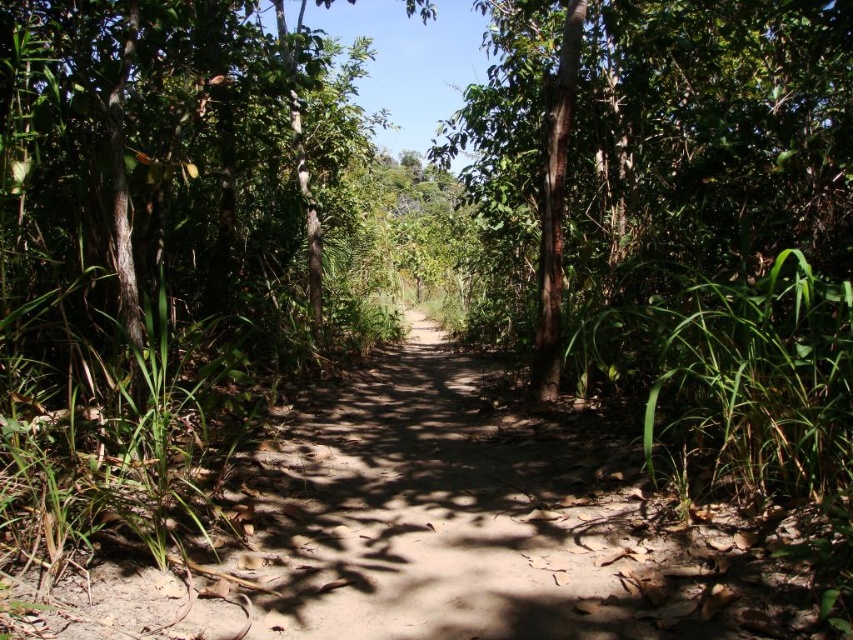
Is brown sandy dirt track at center thinner than green rough bark tree at center?

Indeed, brown sandy dirt track at center has a lesser width compared to green rough bark tree at center.

Is brown sandy dirt track at center further to camera compared to green rough bark tree at center?

No, it is in front of green rough bark tree at center.

Measure the distance between brown sandy dirt track at center and camera.

brown sandy dirt track at center is 1.10 meters from camera.

The height and width of the screenshot is (640, 853). In order to click on brown sandy dirt track at center in this screenshot , I will do `click(445, 532)`.

Identify the location of green leafy tree at center. The height and width of the screenshot is (640, 853). (181, 179).

Does point (202, 196) lie behind point (813, 125)?

That is True.

What do you see at coordinates (181, 179) in the screenshot? I see `green leafy tree at center` at bounding box center [181, 179].

Identify the location of green leafy tree at center. This screenshot has height=640, width=853. (181, 179).

From the picture: Who is shorter, brown sandy dirt track at center or green leafy tree at center?

With less height is brown sandy dirt track at center.

Is point (445, 445) behind point (140, 243)?

Yes, it is behind point (140, 243).

This screenshot has width=853, height=640. In order to click on brown sandy dirt track at center in this screenshot , I will do `click(445, 532)`.